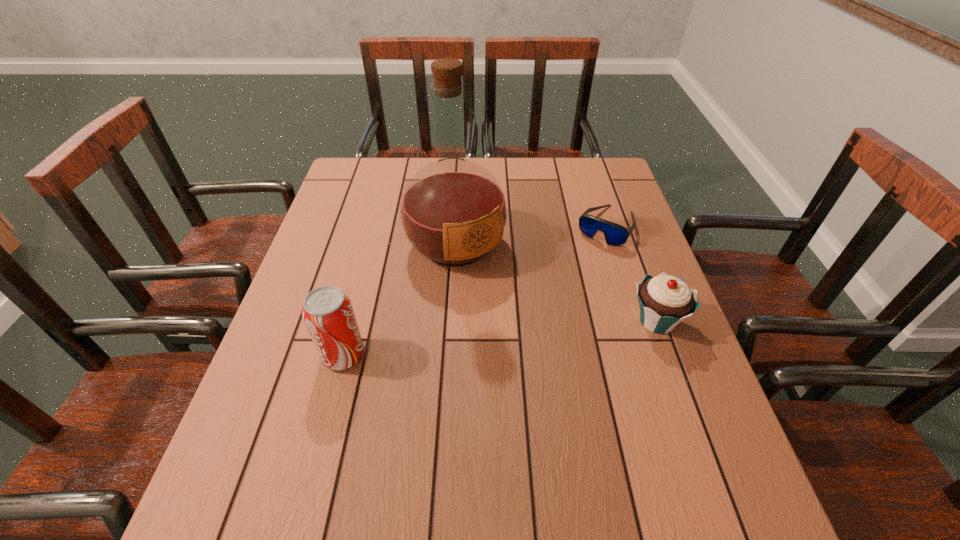
Identify the location of free region located 0.170m on the front-facing side of the sunglasses. (571, 282).

The image size is (960, 540). I want to click on free space located 0.320m on the front label of the second object from left to right, so click(550, 370).

This screenshot has width=960, height=540. Identify the location of blank space located on the front label of the second object from left to right. (550, 370).

Where is `vacant area situated 0.370m on the front label of the second object from left to right`? vacant area situated 0.370m on the front label of the second object from left to right is located at coordinates (564, 388).

The height and width of the screenshot is (540, 960). In order to click on object at the left edge in this screenshot , I will do `click(328, 314)`.

Where is `cupcake that is at the right edge`? The width and height of the screenshot is (960, 540). cupcake that is at the right edge is located at coordinates (665, 301).

Locate an element on the screen. The height and width of the screenshot is (540, 960). sunglasses at the right edge is located at coordinates (615, 235).

In the image, there is a desktop. At what (x,y) coordinates should I click in order to perform the action: click on free space at the far edge. Please return your answer as a coordinate pair (x, y). Looking at the image, I should click on 389,192.

In the image, there is a desktop. Where is `vacant space at the near edge`? The width and height of the screenshot is (960, 540). vacant space at the near edge is located at coordinates (354, 446).

At what (x,y) coordinates should I click in order to perform the action: click on vacant region at the left edge of the desktop. Please return your answer as a coordinate pair (x, y). This screenshot has height=540, width=960. Looking at the image, I should click on (317, 370).